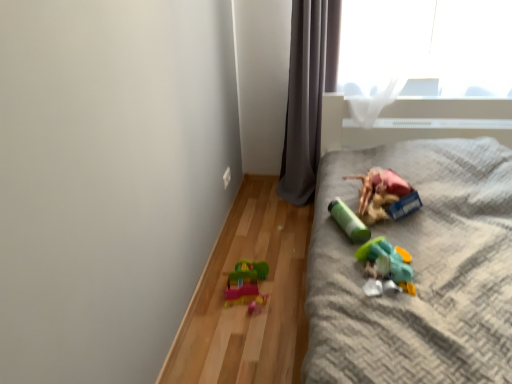
Where is `unoccupied area behind translucent plastic toy at lower left, acting as the fourth toy starting from the right`? This screenshot has height=384, width=512. unoccupied area behind translucent plastic toy at lower left, acting as the fourth toy starting from the right is located at coordinates (253, 254).